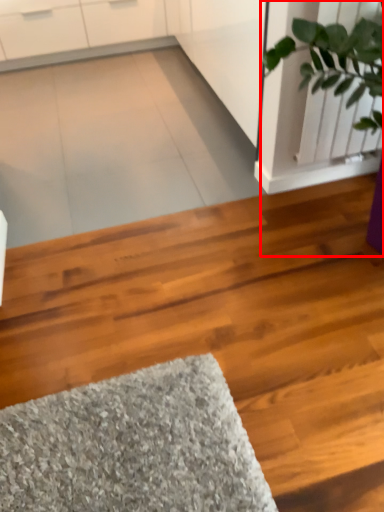
Question: Observing the image, what is the correct spatial positioning of houseplant (annotated by the red box) in reference to hardwood?

Choices:
 (A) right
 (B) left

Answer: (A)